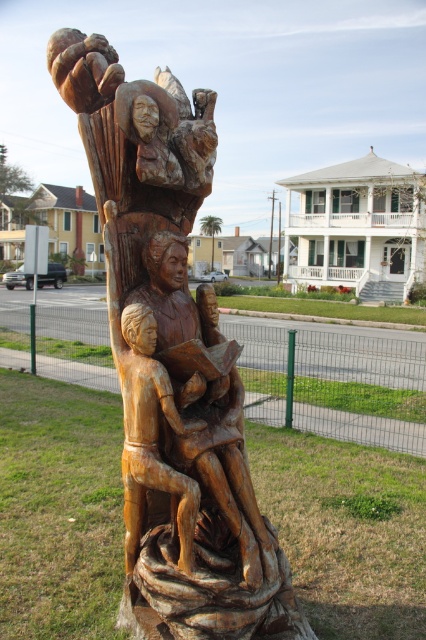
Question: Does natural wood carving at center have a greater width compared to light brown wood carving of person at center?

Choices:
 (A) yes
 (B) no

Answer: (A)

Question: Which point appears closest to the camera in this image?

Choices:
 (A) (230, 346)
 (B) (78, 92)
 (C) (126, 376)

Answer: (C)

Question: From the image, what is the correct spatial relationship of wooden carving at center in relation to light brown wood carving of person at center?

Choices:
 (A) above
 (B) below

Answer: (A)

Question: Considering the real-world distances, which object is farthest from the wooden carving at center?

Choices:
 (A) light brown wood carving of person at center
 (B) natural wood carving at center

Answer: (A)

Question: Does wooden carving at center have a lesser width compared to light brown wood carving of person at center?

Choices:
 (A) yes
 (B) no

Answer: (B)

Question: Which of the following is the farthest from the observer?

Choices:
 (A) (126, 536)
 (B) (221, 337)
 (C) (86, 36)

Answer: (B)